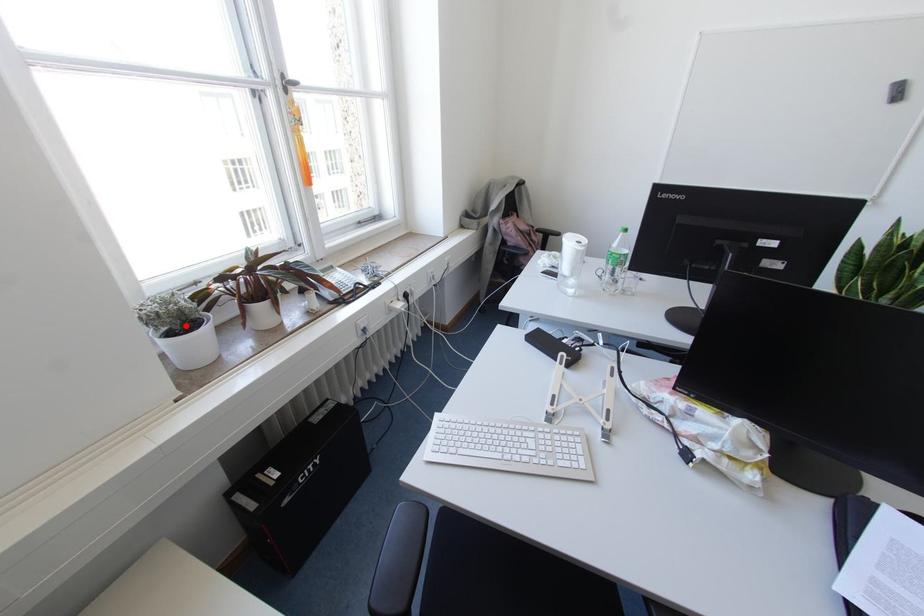
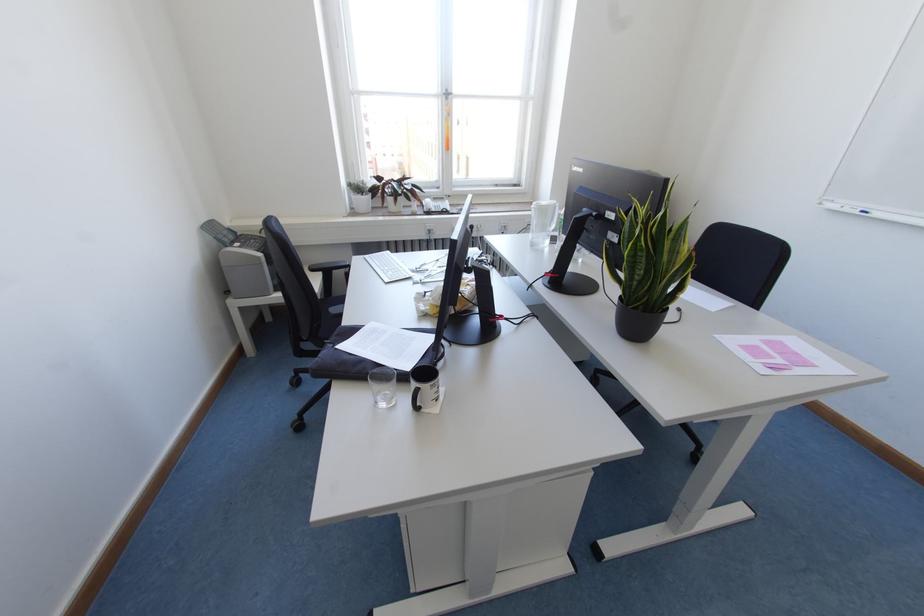
Locate, in the second image, the point that corresponds to the highlighted location in the first image.

(361, 195)